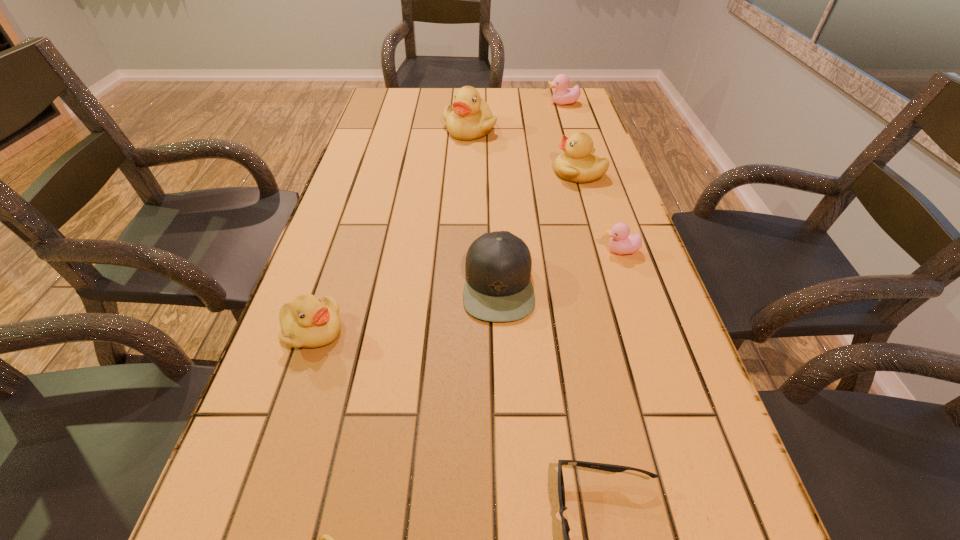
This screenshot has height=540, width=960. Find the location of `vacant space at the right edge of the desktop`. vacant space at the right edge of the desktop is located at coordinates (612, 177).

Where is `vacant area at the far right corner`? This screenshot has height=540, width=960. vacant area at the far right corner is located at coordinates (568, 114).

Where is `empty space that is in between the nearer pink duckling and the tallest object`? Image resolution: width=960 pixels, height=540 pixels. empty space that is in between the nearer pink duckling and the tallest object is located at coordinates (545, 190).

Where is `vacant area between the nearer pink duckling and the rightmost yellow duckling`? vacant area between the nearer pink duckling and the rightmost yellow duckling is located at coordinates (600, 212).

Find the location of a particular element. The height and width of the screenshot is (540, 960). empty location between the seventh nearest object and the leftmost object is located at coordinates (391, 230).

In order to click on object that stands as the third closest to the third smallest yellow duckling in this screenshot , I will do `click(498, 288)`.

At what (x,y) coordinates should I click in order to perform the action: click on object that stands as the fourth closest to the seventh shortest object. Please return your answer as a coordinate pair (x, y). Looking at the image, I should click on (561, 96).

The height and width of the screenshot is (540, 960). Find the location of `the third closest duckling relative to the biggest yellow duckling`. the third closest duckling relative to the biggest yellow duckling is located at coordinates (621, 242).

Identify which duckling is the fourth nearest to the second duckling from left to right. Please provide its 2D coordinates. Your answer should be formatted as a tuple, i.e. [(x, y)], where the tuple contains the x and y coordinates of a point satisfying the conditions above.

[(470, 118)]

Identify which yellow duckling is located as the nearest to the farthest duckling. Please provide its 2D coordinates. Your answer should be formatted as a tuple, i.e. [(x, y)], where the tuple contains the x and y coordinates of a point satisfying the conditions above.

[(470, 118)]